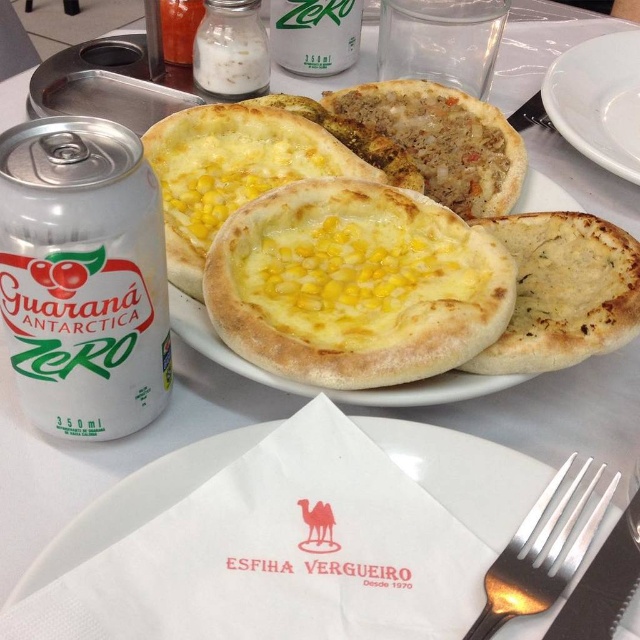
Question: Which of the following is the farthest from the observer?

Choices:
 (A) (145, 179)
 (B) (294, 177)
 (C) (284, 33)
 (D) (541, 99)

Answer: (C)

Question: Is white metallic can at left bigger than silver metallic fork at lower right?

Choices:
 (A) yes
 (B) no

Answer: (A)

Question: In this image, where is white metallic can at left located relative to silver metallic fork at lower right?

Choices:
 (A) below
 (B) above

Answer: (B)

Question: Which point is closer to the camera?

Choices:
 (A) (611, 349)
 (B) (106, 531)
 (C) (582, 305)
 (D) (76, 214)

Answer: (D)

Question: Does yellow cheesy pancake at center come in front of silver metallic fork at lower right?

Choices:
 (A) no
 (B) yes

Answer: (A)

Question: Which of the following is the closest to the observer?

Choices:
 (A) yellow cheesy bread at center
 (B) white ceramic plate at upper right
 (C) yellow cheesy pancake at center
 (D) white metallic can at left

Answer: (D)